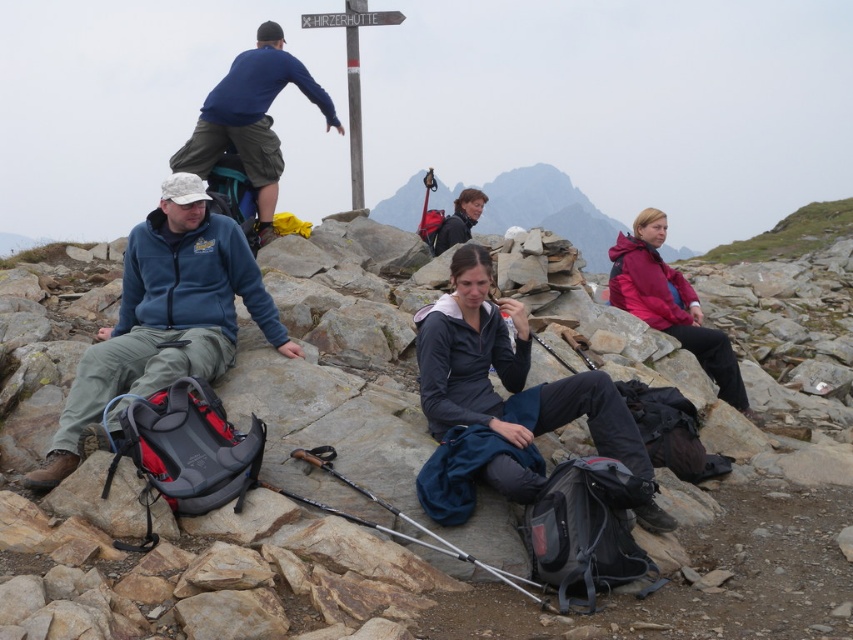
You are a photographer trying to capture the entire scene of the hikers resting on the rocky terrain. You notice two points marked as point 1 at coordinates point (279, 28) and point 2 at coordinates point (527, 211). Which point is closer to your camera lens so you can focus properly?

Point (279, 28) is closer to the camera lens than point (527, 211), so focus on that point first.

You are a hiker trying to decide where to place your tent. You have two options for spots near the blue fleece jacket at left and the matte black jacket at center. Which spot has more space for your tent based on the jackets?

The blue fleece jacket at left has a larger width than the matte black jacket at center, so the spot near the blue fleece jacket at left likely has more space for your tent.